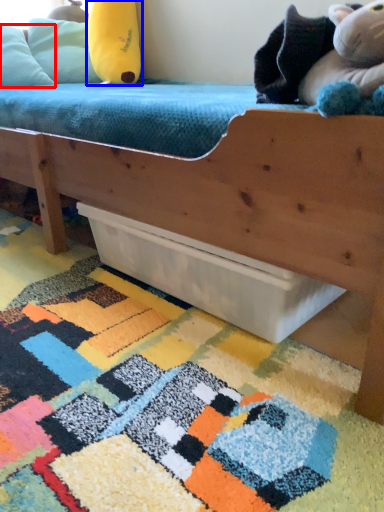
Question: Which object is closer to the camera taking this photo, pillow (highlighted by a red box) or toy (highlighted by a blue box)?

Choices:
 (A) pillow
 (B) toy

Answer: (A)